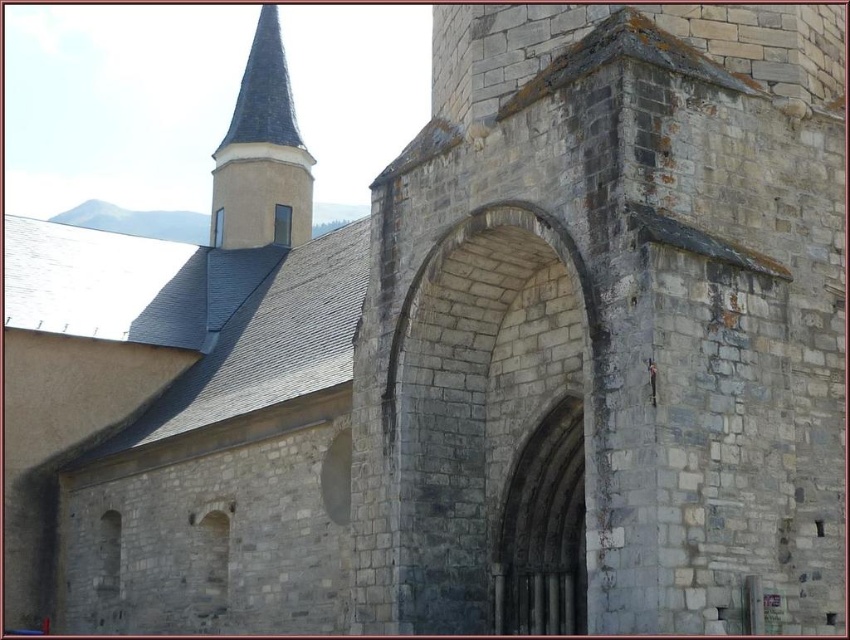
You are standing in front of the historic stone building and want to take a photo of both the gray stone archway at center and the smooth gray stone spire at upper left. Which object should you position to the left side of your camera frame to include both in the photo?

You should position the smooth gray stone spire at upper left to the left side of your camera frame because the gray stone archway at center is to the right of the smooth gray stone spire at upper left.

You are standing in front of a historic stone building and want to take a photo of the gray stone archway at center. If your camera can focus on objects up to 30 meters away, will it be able to capture the archway clearly?

The gray stone archway at center is 30.21 meters from viewer, which is slightly beyond the camera focus range of 30 meters. Therefore, the camera may not be able to capture the archway clearly.

You are standing in front of the historic stone building and want to touch both the gray stone archway at center and the smooth gray stone spire at upper left. Which one can you reach first without moving your position?

The gray stone archway at center is closer to the viewer than the smooth gray stone spire at upper left, so you can reach the gray stone archway at center first without moving your position.